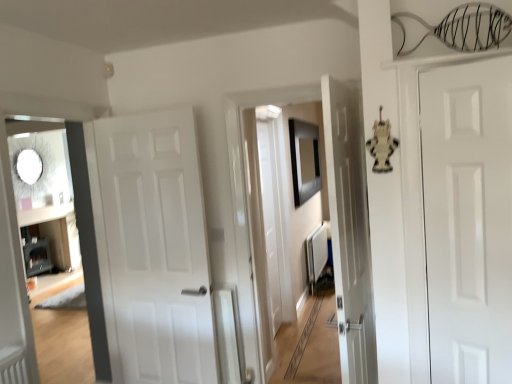
Question: Is white glossy door at right, acting as the 2th door starting from the back, located outside white matte radiator at center?

Choices:
 (A) yes
 (B) no

Answer: (A)

Question: Is white glossy door at right, acting as the 2th door starting from the back, not near white matte radiator at center?

Choices:
 (A) no
 (B) yes

Answer: (B)

Question: From a real-world perspective, is white glossy door at right, which is counted as the first door, starting from the right, below white matte radiator at center?

Choices:
 (A) no
 (B) yes

Answer: (A)

Question: From the image's perspective, is white glossy door at right, which is counted as the first door, starting from the right, on white matte radiator at center?

Choices:
 (A) yes
 (B) no

Answer: (A)

Question: Can you confirm if white glossy door at right, the 1th door from the front, is thinner than white matte radiator at center?

Choices:
 (A) no
 (B) yes

Answer: (B)

Question: Is white glossy door at right, acting as the 2th door starting from the back, positioned with its back to white matte radiator at center?

Choices:
 (A) yes
 (B) no

Answer: (B)

Question: Is white matte door at center, placed as the first door when sorted from back to front, at the right side of white matte radiator at center?

Choices:
 (A) no
 (B) yes

Answer: (A)

Question: Can you confirm if white matte door at center, positioned as the first door in left-to-right order, is wider than white matte radiator at center?

Choices:
 (A) no
 (B) yes

Answer: (A)

Question: From a real-world perspective, is white matte door at center, which is the second door in right-to-left order, over white matte radiator at center?

Choices:
 (A) no
 (B) yes

Answer: (B)

Question: Is white matte door at center, which is the second door in right-to-left order, oriented towards white matte radiator at center?

Choices:
 (A) yes
 (B) no

Answer: (B)

Question: Is white matte door at center, which is the 2th door in front-to-back order, thinner than white matte radiator at center?

Choices:
 (A) no
 (B) yes

Answer: (B)

Question: Does white matte door at center, which is the 2th door in front-to-back order, have a smaller size compared to white matte radiator at center?

Choices:
 (A) yes
 (B) no

Answer: (B)

Question: Is white matte radiator at center oriented away from black matte picture frame at center?

Choices:
 (A) no
 (B) yes

Answer: (A)